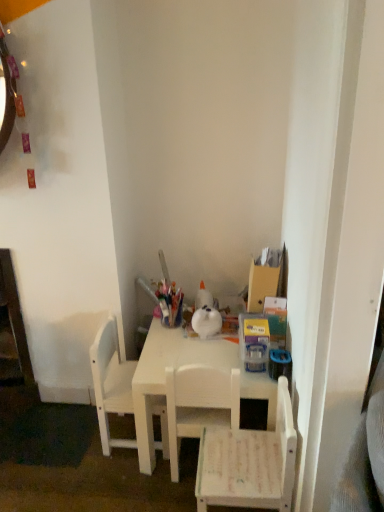
Describe the element at coordinates (111, 383) in the screenshot. I see `white matte chair at left, the first chair positioned from the left` at that location.

How much space does white matte chair at lower right, which ranks as the third chair in left-to-right order, occupy horizontally?

The width of white matte chair at lower right, which ranks as the third chair in left-to-right order, is 12.28 inches.

Find the location of a particular element. white matte chair at center, which ranks as the 2th chair in right-to-left order is located at coordinates (199, 404).

Image resolution: width=384 pixels, height=512 pixels. What are the coordinates of `white matte chair at left, the first chair positioned from the left` in the screenshot? It's located at (111, 383).

Is white matte chair at center, which ranks as the 2th chair in right-to-left order, turned away from white matte table at center?

Yes, white matte table at center is at the back of white matte chair at center, which ranks as the 2th chair in right-to-left order.

Does white matte chair at center, marked as the 2th chair in a left-to-right arrangement, appear on the right side of white matte table at center?

In fact, white matte chair at center, marked as the 2th chair in a left-to-right arrangement, is to the left of white matte table at center.

Who is more distant, white matte chair at center, marked as the 2th chair in a left-to-right arrangement, or white matte table at center?

white matte table at center is further from the camera.

From the image's perspective, which one is positioned higher, white matte chair at center, marked as the 2th chair in a left-to-right arrangement, or white matte table at center?

white matte table at center appears higher in the image.

Who is taller, white matte table at center or white matte chair at lower right, which appears as the first chair when viewed from the right?

Standing taller between the two is white matte chair at lower right, which appears as the first chair when viewed from the right.

Is white matte table at center facing towards white matte chair at lower right, which appears as the first chair when viewed from the right?

No, white matte table at center is not facing towards white matte chair at lower right, which appears as the first chair when viewed from the right.

Considering the positions of point (177, 333) and point (234, 453), is point (177, 333) closer or farther from the camera than point (234, 453)?

Clearly, point (177, 333) is more distant from the camera than point (234, 453).

Is white matte chair at lower right, which appears as the first chair when viewed from the right, looking in the opposite direction of white matte table at center?

No, white matte table at center is not at the back of white matte chair at lower right, which appears as the first chair when viewed from the right.

Considering the relative positions of white matte chair at lower right, which ranks as the third chair in left-to-right order, and white matte table at center in the image provided, is white matte chair at lower right, which ranks as the third chair in left-to-right order, to the left of white matte table at center from the viewer's perspective?

Incorrect, white matte chair at lower right, which ranks as the third chair in left-to-right order, is not on the left side of white matte table at center.

Considering the relative sizes of white matte chair at lower right, which ranks as the third chair in left-to-right order, and white matte table at center in the image provided, is white matte chair at lower right, which ranks as the third chair in left-to-right order, thinner than white matte table at center?

Yes.

From the image's perspective, is white matte chair at lower right, which ranks as the third chair in left-to-right order, above white matte chair at center, which ranks as the 2th chair in right-to-left order?

Incorrect, from the image's perspective, white matte chair at lower right, which ranks as the third chair in left-to-right order, is lower than white matte chair at center, which ranks as the 2th chair in right-to-left order.

Considering the sizes of objects white matte chair at lower right, which ranks as the third chair in left-to-right order, and white matte chair at center, marked as the 2th chair in a left-to-right arrangement, in the image provided, who is wider, white matte chair at lower right, which ranks as the third chair in left-to-right order, or white matte chair at center, marked as the 2th chair in a left-to-right arrangement,?

white matte chair at lower right, which ranks as the third chair in left-to-right order, is wider.

Is white matte chair at lower right, which appears as the first chair when viewed from the right, beside white matte chair at center, marked as the 2th chair in a left-to-right arrangement?

white matte chair at lower right, which appears as the first chair when viewed from the right, and white matte chair at center, marked as the 2th chair in a left-to-right arrangement, are not in contact.

Is white matte chair at lower right, which ranks as the third chair in left-to-right order, behind white matte chair at center, marked as the 2th chair in a left-to-right arrangement?

No.

Which of these two, white matte chair at center, marked as the 2th chair in a left-to-right arrangement, or white matte chair at lower right, which ranks as the third chair in left-to-right order, is smaller?

Smaller between the two is white matte chair at center, marked as the 2th chair in a left-to-right arrangement.

From a real-world perspective, is white matte chair at center, marked as the 2th chair in a left-to-right arrangement, below white matte chair at lower right, which ranks as the third chair in left-to-right order?

Actually, white matte chair at center, marked as the 2th chair in a left-to-right arrangement, is physically above white matte chair at lower right, which ranks as the third chair in left-to-right order, in the real world.

Considering the positions of objects white matte chair at center, marked as the 2th chair in a left-to-right arrangement, and white matte chair at lower right, which ranks as the third chair in left-to-right order, in the image provided, who is in front, white matte chair at center, marked as the 2th chair in a left-to-right arrangement, or white matte chair at lower right, which ranks as the third chair in left-to-right order,?

Positioned in front is white matte chair at lower right, which ranks as the third chair in left-to-right order.

Would you say white matte chair at center, which ranks as the 2th chair in right-to-left order, is inside or outside white matte chair at lower right, which ranks as the third chair in left-to-right order?

white matte chair at center, which ranks as the 2th chair in right-to-left order, exists outside the volume of white matte chair at lower right, which ranks as the third chair in left-to-right order.

You are a GUI agent. You are given a task and a screenshot of the screen. Output one action in this format:
    pyautogui.click(x=<x>, y=<y>)
    Task: Click on the 1st chair to the right of the white matte chair at left, which ranks as the 3th chair in right-to-left order, starting your count from the anchor
    The image size is (384, 512).
    Given the screenshot: What is the action you would take?
    pyautogui.click(x=199, y=404)

Is white matte chair at center, marked as the 2th chair in a left-to-right arrangement, closer to camera compared to white matte chair at left, which ranks as the 3th chair in right-to-left order?

Yes, it is.

Which object is positioned more to the left, white matte chair at center, which ranks as the 2th chair in right-to-left order, or white matte chair at left, which ranks as the 3th chair in right-to-left order?

From the viewer's perspective, white matte chair at left, which ranks as the 3th chair in right-to-left order, appears more on the left side.

Is white matte chair at center, which ranks as the 2th chair in right-to-left order, touching white matte chair at left, the first chair positioned from the left?

No, white matte chair at center, which ranks as the 2th chair in right-to-left order, is not in contact with white matte chair at left, the first chair positioned from the left.

Is white matte table at center not near white matte chair at center, which ranks as the 2th chair in right-to-left order?

No, white matte table at center is not far from white matte chair at center, which ranks as the 2th chair in right-to-left order.

From the picture: Can we say white matte table at center lies outside white matte chair at center, marked as the 2th chair in a left-to-right arrangement?

Indeed, white matte table at center is completely outside white matte chair at center, marked as the 2th chair in a left-to-right arrangement.

Which is in front, point (179, 332) or point (213, 412)?

The point (213, 412) is more forward.

Who is bigger, white matte table at center or white matte chair at center, which ranks as the 2th chair in right-to-left order?

With larger size is white matte table at center.

Find the location of a particular element. the 2nd chair above the white matte table at center (from a real-world perspective) is located at coordinates (199, 404).

Find the location of a particular element. This screenshot has width=384, height=512. table to the left of white matte chair at lower right, which ranks as the third chair in left-to-right order is located at coordinates (181, 366).

When comparing their distances from white matte chair at lower right, which appears as the first chair when viewed from the right, does white matte table at center or white matte chair at center, marked as the 2th chair in a left-to-right arrangement, seem further?

Based on the image, white matte table at center appears to be further to white matte chair at lower right, which appears as the first chair when viewed from the right.

From the image, which object appears to be farther from white matte chair at lower right, which appears as the first chair when viewed from the right, white matte chair at left, which ranks as the 3th chair in right-to-left order, or white matte chair at center, which ranks as the 2th chair in right-to-left order?

white matte chair at left, which ranks as the 3th chair in right-to-left order, lies further to white matte chair at lower right, which appears as the first chair when viewed from the right, than the other object.

When comparing their distances from white matte table at center, does white matte chair at lower right, which ranks as the third chair in left-to-right order, or white matte chair at center, which ranks as the 2th chair in right-to-left order, seem closer?

white matte chair at center, which ranks as the 2th chair in right-to-left order.

Considering their positions, is white matte chair at lower right, which ranks as the third chair in left-to-right order, positioned further to white matte table at center than white matte chair at left, which ranks as the 3th chair in right-to-left order?

white matte chair at lower right, which ranks as the third chair in left-to-right order, lies further to white matte table at center than the other object.

Estimate the real-world distances between objects in this image. Which object is further from white matte chair at center, which ranks as the 2th chair in right-to-left order, white matte table at center or white matte chair at lower right, which ranks as the third chair in left-to-right order?

The object further to white matte chair at center, which ranks as the 2th chair in right-to-left order, is white matte chair at lower right, which ranks as the third chair in left-to-right order.

Which object lies further to the anchor point white matte chair at left, the first chair positioned from the left, white matte chair at lower right, which ranks as the third chair in left-to-right order, or white matte chair at center, which ranks as the 2th chair in right-to-left order?

white matte chair at lower right, which ranks as the third chair in left-to-right order, is positioned further to the anchor white matte chair at left, the first chair positioned from the left.

Looking at the image, which one is located closer to white matte chair at left, the first chair positioned from the left, white matte table at center or white matte chair at lower right, which appears as the first chair when viewed from the right?

white matte table at center.

When comparing their distances from white matte chair at left, which ranks as the 3th chair in right-to-left order, does white matte chair at lower right, which ranks as the third chair in left-to-right order, or white matte table at center seem further?

white matte chair at lower right, which ranks as the third chair in left-to-right order, is further to white matte chair at left, which ranks as the 3th chair in right-to-left order.

Where is `chair positioned between white matte chair at lower right, which ranks as the third chair in left-to-right order, and white matte table at center from near to far`? The image size is (384, 512). chair positioned between white matte chair at lower right, which ranks as the third chair in left-to-right order, and white matte table at center from near to far is located at coordinates (199, 404).

The height and width of the screenshot is (512, 384). Identify the location of chair between white matte chair at left, which ranks as the 3th chair in right-to-left order, and white matte chair at lower right, which appears as the first chair when viewed from the right, from left to right. (199, 404).

Where is `table situated between white matte chair at left, the first chair positioned from the left, and white matte chair at lower right, which appears as the first chair when viewed from the right, from left to right`? This screenshot has height=512, width=384. table situated between white matte chair at left, the first chair positioned from the left, and white matte chair at lower right, which appears as the first chair when viewed from the right, from left to right is located at coordinates (181, 366).

You are a GUI agent. You are given a task and a screenshot of the screen. Output one action in this format:
    pyautogui.click(x=<x>, y=<y>)
    Task: Click on the chair situated between white matte chair at left, the first chair positioned from the left, and white matte table at center from left to right
    The image size is (384, 512).
    Given the screenshot: What is the action you would take?
    point(199,404)